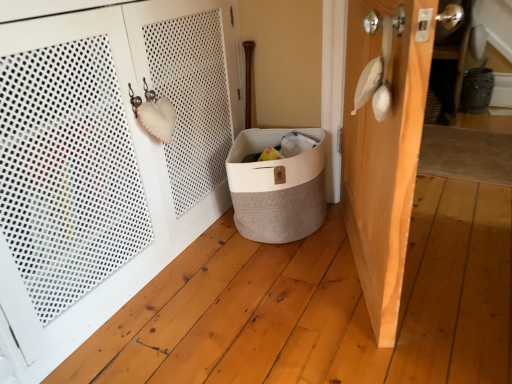
Question: Is wooden door at right, placed as the 2th door when sorted from left to right, closer to the viewer compared to white woven basket at lower right, which ranks as the 2th door in right-to-left order?

Choices:
 (A) yes
 (B) no

Answer: (B)

Question: From the image's perspective, is wooden door at right, acting as the first door starting from the right, below white woven basket at lower right, placed as the 1th door when sorted from left to right?

Choices:
 (A) yes
 (B) no

Answer: (A)

Question: Is white woven basket at lower right, which ranks as the 2th door in right-to-left order, surrounded by wooden door at right, placed as the 2th door when sorted from left to right?

Choices:
 (A) yes
 (B) no

Answer: (B)

Question: Is wooden door at right, acting as the first door starting from the right, wider than white woven basket at lower right, which ranks as the 2th door in right-to-left order?

Choices:
 (A) no
 (B) yes

Answer: (A)

Question: Is wooden door at right, acting as the first door starting from the right, far from white woven basket at lower right, placed as the 1th door when sorted from left to right?

Choices:
 (A) no
 (B) yes

Answer: (A)

Question: Is white woven basket at lower right, placed as the 1th door when sorted from left to right, bigger or smaller than wooden door at right, acting as the first door starting from the right?

Choices:
 (A) big
 (B) small

Answer: (A)

Question: From their relative heights in the image, would you say white woven basket at lower right, placed as the 1th door when sorted from left to right, is taller or shorter than wooden door at right, placed as the 2th door when sorted from left to right?

Choices:
 (A) tall
 (B) short

Answer: (A)

Question: From the image's perspective, is white woven basket at lower right, which ranks as the 2th door in right-to-left order, located above or below wooden door at right, acting as the first door starting from the right?

Choices:
 (A) above
 (B) below

Answer: (A)

Question: Is white woven basket at lower right, placed as the 1th door when sorted from left to right, inside or outside of wooden door at right, placed as the 2th door when sorted from left to right?

Choices:
 (A) outside
 (B) inside

Answer: (A)

Question: From the image's perspective, is white woven basket at lower right, placed as the 1th door when sorted from left to right, located above or below beige woven laundry basket at center?

Choices:
 (A) below
 (B) above

Answer: (B)

Question: In the image, is white woven basket at lower right, placed as the 1th door when sorted from left to right, positioned in front of or behind beige woven laundry basket at center?

Choices:
 (A) behind
 (B) front

Answer: (B)

Question: Based on their sizes in the image, would you say white woven basket at lower right, placed as the 1th door when sorted from left to right, is bigger or smaller than beige woven laundry basket at center?

Choices:
 (A) small
 (B) big

Answer: (B)

Question: From their relative heights in the image, would you say white woven basket at lower right, placed as the 1th door when sorted from left to right, is taller or shorter than beige woven laundry basket at center?

Choices:
 (A) tall
 (B) short

Answer: (A)

Question: Considering the positions of point (349, 190) and point (144, 26), is point (349, 190) closer or farther from the camera than point (144, 26)?

Choices:
 (A) farther
 (B) closer

Answer: (A)

Question: Looking at their shapes, would you say wooden door at right, acting as the first door starting from the right, is wider or thinner than white woven basket at lower right, which ranks as the 2th door in right-to-left order?

Choices:
 (A) thin
 (B) wide

Answer: (A)